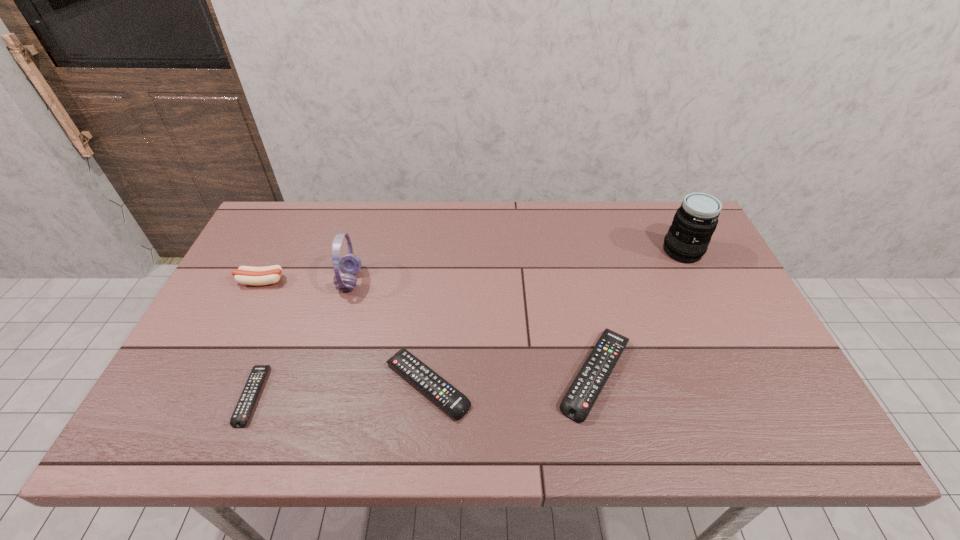
Identify the location of the shortest remote control. The image size is (960, 540). (x=244, y=407).

I want to click on the shortest object, so click(x=244, y=407).

Find the location of `the second remote control from left to right`. the second remote control from left to right is located at coordinates (450, 399).

At what (x,y) coordinates should I click in order to perform the action: click on the fourth object from left to right. Please return your answer as a coordinate pair (x, y). Looking at the image, I should click on (450, 399).

Locate an element on the screen. The image size is (960, 540). the rightmost remote control is located at coordinates (578, 401).

This screenshot has height=540, width=960. I want to click on telephoto lens, so click(687, 240).

Where is `the third tallest object`? the third tallest object is located at coordinates (247, 275).

The height and width of the screenshot is (540, 960). What are the coordinates of `sausage` in the screenshot? It's located at (247, 275).

This screenshot has width=960, height=540. What are the coordinates of `headset` in the screenshot? It's located at (349, 264).

The image size is (960, 540). Find the location of `the third object from left to right`. the third object from left to right is located at coordinates (349, 264).